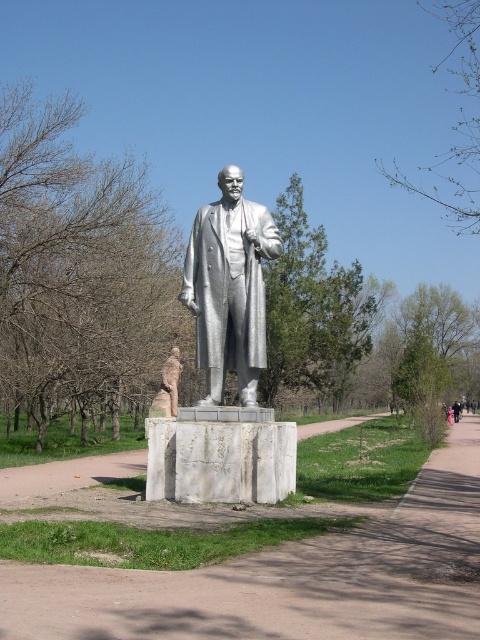
Question: Among these objects, which one is farthest from the camera?

Choices:
 (A) white marble path at center
 (B) matte bronze statue at center

Answer: (B)

Question: Does white marble path at center have a greater width compared to polished silver statue at center?

Choices:
 (A) yes
 (B) no

Answer: (A)

Question: Can you confirm if white marble path at center is wider than silver polished statue at center?

Choices:
 (A) yes
 (B) no

Answer: (A)

Question: Which point is closer to the camera?

Choices:
 (A) white marble path at center
 (B) matte bronze statue at center

Answer: (A)

Question: Is white marble path at center further to the viewer compared to polished silver statue at center?

Choices:
 (A) no
 (B) yes

Answer: (A)

Question: Which object appears farthest from the camera in this image?

Choices:
 (A) polished silver statue at center
 (B) silver polished statue at center

Answer: (A)